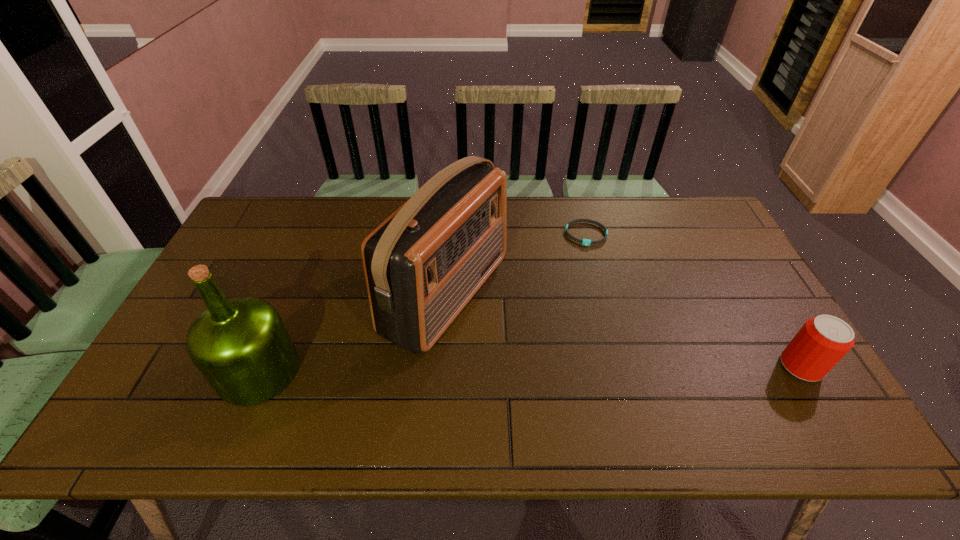
Image resolution: width=960 pixels, height=540 pixels. I want to click on free area in between the second object from right to left and the rightmost object, so click(x=693, y=300).

At what (x,y) coordinates should I click in order to perform the action: click on unoccupied position between the olive oil and the beer can. Please return your answer as a coordinate pair (x, y). This screenshot has width=960, height=540. Looking at the image, I should click on (530, 369).

I want to click on the closest object to the olive oil, so click(423, 264).

The width and height of the screenshot is (960, 540). Identify the location of object that is the third nearest to the wristband. (241, 346).

You are a GUI agent. You are given a task and a screenshot of the screen. Output one action in this format:
    pyautogui.click(x=<x>, y=<y>)
    Task: Click on the free point that satisfies the following two spatial constraints: 1. on the back side of the third tallest object; 2. on the left side of the olive oil
    This screenshot has height=540, width=960.
    Given the screenshot: What is the action you would take?
    pyautogui.click(x=260, y=366)